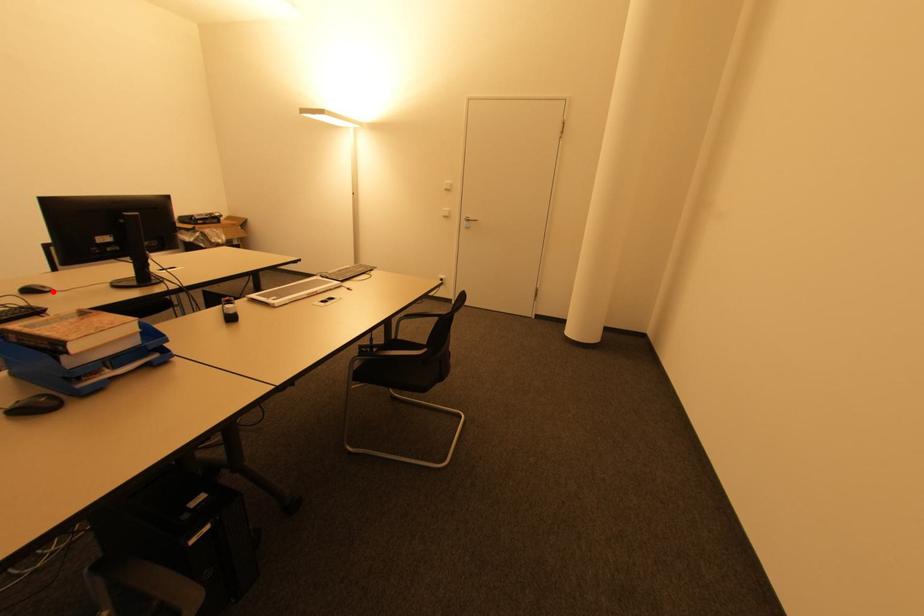
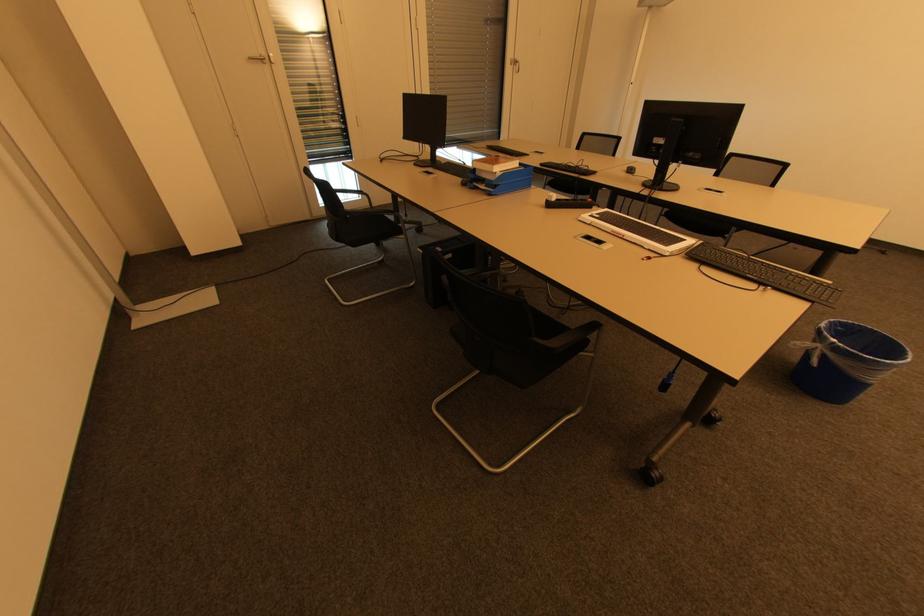
Question: I am providing you with two images of the same scene from different viewpoints. Given a red point in image1, look at the same physical point in image2. Is it:

Choices:
 (A) Closer to the viewpoint
 (B) Farther from the viewpoint

Answer: (A)